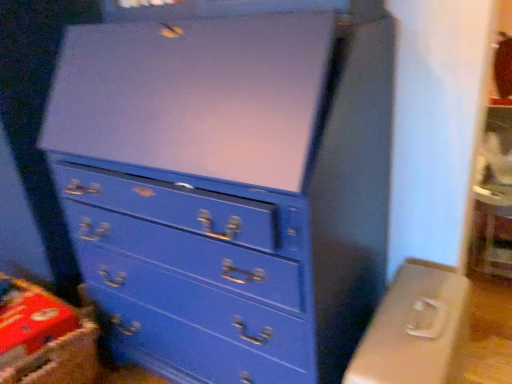
Question: From the image's perspective, is red cardboard crate at lower left positioned above or below matte plastic computer desk at lower right?

Choices:
 (A) above
 (B) below

Answer: (A)

Question: Is red cardboard crate at lower left to the left or to the right of matte plastic computer desk at lower right in the image?

Choices:
 (A) right
 (B) left

Answer: (B)

Question: Which object is the farthest from the red cardboard crate at lower left?

Choices:
 (A) matte blue dresser at center
 (B) matte plastic computer desk at lower right

Answer: (B)

Question: Estimate the real-world distances between objects in this image. Which object is closer to the red cardboard crate at lower left?

Choices:
 (A) matte plastic computer desk at lower right
 (B) matte blue dresser at center

Answer: (B)